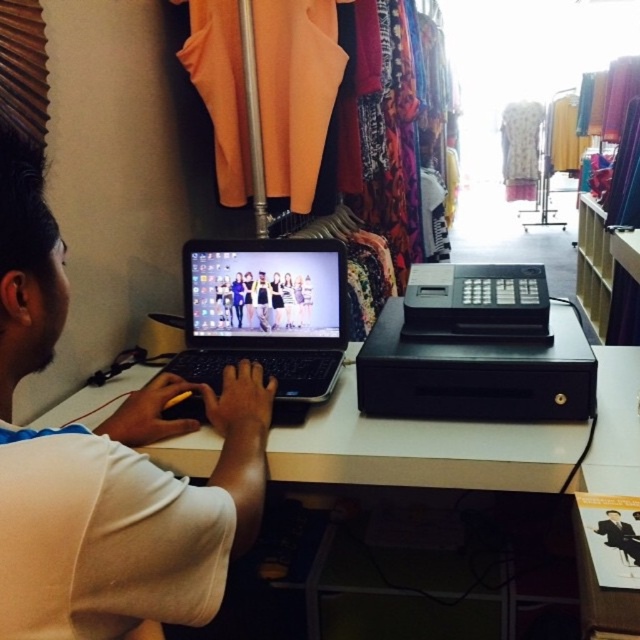
Is black plastic cash register at right further to camera compared to smooth black suit at center?

Yes, it is.

Does point (592, 401) lie behind point (618, 541)?

Yes.

Where is `black plastic cash register at right`? The height and width of the screenshot is (640, 640). black plastic cash register at right is located at coordinates (476, 372).

Based on the photo, between white matte laptop at center and black matte laptop at center, which one is positioned lower?

white matte laptop at center is below.

Is white matte laptop at center below black matte laptop at center?

Yes, white matte laptop at center is below black matte laptop at center.

Does point (205, 385) come behind point (291, 282)?

No, (205, 385) is in front of (291, 282).

The height and width of the screenshot is (640, 640). I want to click on white matte laptop at center, so (x=106, y=465).

Measure the distance between point (472, 372) and camera.

They are 99.41 centimeters apart.

Can you confirm if black plastic cash register at right is taller than matte black laptop at center?

Yes.

Is point (497, 346) positioned behind point (262, 300)?

No.

This screenshot has height=640, width=640. In order to click on black plastic cash register at right in this screenshot , I will do `click(476, 372)`.